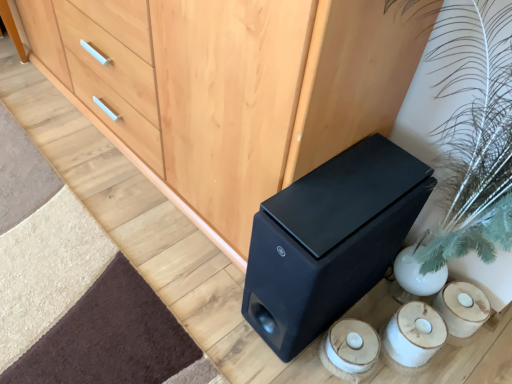
Question: Is white ceramic candle holder at lower right in front of or behind matte black speaker at lower right in the image?

Choices:
 (A) front
 (B) behind

Answer: (B)

Question: Do you think white ceramic candle holder at lower right is within matte black speaker at lower right, or outside of it?

Choices:
 (A) inside
 (B) outside

Answer: (B)

Question: Based on their relative distances, which object is farther from the white ceramic candle holder at lower right?

Choices:
 (A) matte black speaker at lower right
 (B) matte wood chest of drawers at center

Answer: (B)

Question: Which object is the closest to the white ceramic candle holder at lower right?

Choices:
 (A) matte black speaker at lower right
 (B) matte wood chest of drawers at center

Answer: (A)